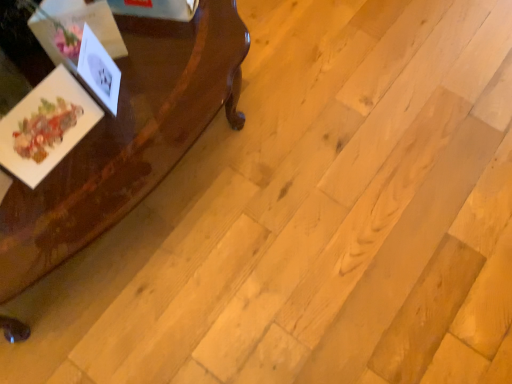
Image resolution: width=512 pixels, height=384 pixels. Find the location of `free spot to the right of white paper at left, which appears as the 2th postcard when viewed from the left`. free spot to the right of white paper at left, which appears as the 2th postcard when viewed from the left is located at coordinates (173, 87).